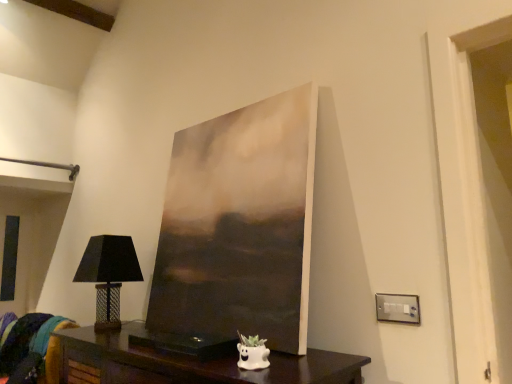
What do you see at coordinates (397, 308) in the screenshot? Image resolution: width=512 pixels, height=384 pixels. I see `satin silver switchplate at lower right` at bounding box center [397, 308].

This screenshot has width=512, height=384. Describe the element at coordinates (189, 363) in the screenshot. I see `dark wood table at lower center` at that location.

Identify the location of velvet teal cushion at lower left. This screenshot has height=384, width=512. (32, 349).

Which object is thinner, matte black lampshade at left or dark wood table at lower center?

Thinner between the two is matte black lampshade at left.

Measure the distance from matte black lampshade at left to dark wood table at lower center.

matte black lampshade at left and dark wood table at lower center are 39.56 centimeters apart.

Would you say matte black lampshade at left contains dark wood table at lower center?

No.

Is satin silver switchplate at lower right located within dark wood table at lower center?

No, satin silver switchplate at lower right is not surrounded by dark wood table at lower center.

Measure the distance from dark wood table at lower center to satin silver switchplate at lower right.

66.97 centimeters.

Is the position of dark wood table at lower center more distant than that of satin silver switchplate at lower right?

No, it is in front of satin silver switchplate at lower right.

Consider the image. Who is taller, dark wood table at lower center or satin silver switchplate at lower right?

With more height is dark wood table at lower center.

Looking at this image, is velvet teal cushion at lower left completely or partially outside of satin silver switchplate at lower right?

Yes, velvet teal cushion at lower left is located beyond the bounds of satin silver switchplate at lower right.

Considering the relative positions of velvet teal cushion at lower left and satin silver switchplate at lower right in the image provided, is velvet teal cushion at lower left to the left of satin silver switchplate at lower right from the viewer's perspective?

Yes.

The width and height of the screenshot is (512, 384). What are the coordinates of `swivel chair behind the satin silver switchplate at lower right` in the screenshot? It's located at (32, 349).

Does velvet teal cushion at lower left have a lesser width compared to satin silver switchplate at lower right?

No, velvet teal cushion at lower left is not thinner than satin silver switchplate at lower right.

Looking at this image, how distant is satin silver switchplate at lower right from matte black lampshade at left?

satin silver switchplate at lower right and matte black lampshade at left are 1.38 meters apart from each other.

Between satin silver switchplate at lower right and matte black lampshade at left, which one has larger size?

With larger size is matte black lampshade at left.

Is matte black lampshade at left completely or partially inside satin silver switchplate at lower right?

That's incorrect, matte black lampshade at left is not inside satin silver switchplate at lower right.

Could you tell me if satin silver switchplate at lower right is turned towards matte black lampshade at left?

No, satin silver switchplate at lower right does not turn towards matte black lampshade at left.

Considering the positions of point (139, 377) and point (50, 344), is point (139, 377) closer or farther from the camera than point (50, 344)?

Point (139, 377) appears to be closer to the viewer than point (50, 344).

Is dark wood table at lower center looking in the opposite direction of velvet teal cushion at lower left?

No, dark wood table at lower center is not facing the opposite direction of velvet teal cushion at lower left.

Find the location of `table beneath the velvet teal cushion at lower left (from a real-world perspective)`. table beneath the velvet teal cushion at lower left (from a real-world perspective) is located at coordinates (189, 363).

Is dark wood table at lower center bigger or smaller than velvet teal cushion at lower left?

Clearly, dark wood table at lower center is larger in size than velvet teal cushion at lower left.

Considering the relative positions of matte black lampshade at left and velvet teal cushion at lower left in the image provided, is matte black lampshade at left to the left of velvet teal cushion at lower left from the viewer's perspective?

No.

Is matte black lampshade at left taller than velvet teal cushion at lower left?

Indeed, matte black lampshade at left has a greater height compared to velvet teal cushion at lower left.

Is matte black lampshade at left in contact with velvet teal cushion at lower left?

No, matte black lampshade at left is not with velvet teal cushion at lower left.

How different are the orientations of matte black lampshade at left and velvet teal cushion at lower left in degrees?

The angular difference between matte black lampshade at left and velvet teal cushion at lower left is 35.6 degrees.

Could you tell me if velvet teal cushion at lower left is turned towards dark wood table at lower center?

No, velvet teal cushion at lower left is not aimed at dark wood table at lower center.

Visually, is velvet teal cushion at lower left positioned to the left or to the right of dark wood table at lower center?

Based on their positions, velvet teal cushion at lower left is located to the left of dark wood table at lower center.

From the image's perspective, does velvet teal cushion at lower left appear higher than dark wood table at lower center?

Actually, velvet teal cushion at lower left appears below dark wood table at lower center in the image.

The height and width of the screenshot is (384, 512). What are the coordinates of `table lamp positioned vertically above the dark wood table at lower center (from a real-world perspective)` in the screenshot? It's located at (x=108, y=275).

Where is `electric outlet that appears on the right of dark wood table at lower center`? The height and width of the screenshot is (384, 512). electric outlet that appears on the right of dark wood table at lower center is located at coordinates (397, 308).

From the image, which object appears to be farther from satin silver switchplate at lower right, dark wood table at lower center or velvet teal cushion at lower left?

velvet teal cushion at lower left is positioned further to the anchor satin silver switchplate at lower right.

Considering their positions, is matte black lampshade at left positioned closer to dark wood table at lower center than satin silver switchplate at lower right?

Based on the image, matte black lampshade at left appears to be nearer to dark wood table at lower center.

Estimate the real-world distances between objects in this image. Which object is closer to velvet teal cushion at lower left, satin silver switchplate at lower right or matte black lampshade at left?

Based on the image, matte black lampshade at left appears to be nearer to velvet teal cushion at lower left.

Considering their positions, is dark wood table at lower center positioned closer to velvet teal cushion at lower left than matte black lampshade at left?

matte black lampshade at left is positioned closer to the anchor velvet teal cushion at lower left.

Looking at the image, which one is located further to satin silver switchplate at lower right, dark wood table at lower center or matte black lampshade at left?

matte black lampshade at left lies further to satin silver switchplate at lower right than the other object.

Looking at the image, which one is located closer to matte black lampshade at left, satin silver switchplate at lower right or velvet teal cushion at lower left?

Among the two, velvet teal cushion at lower left is located nearer to matte black lampshade at left.

In the scene shown: Looking at the image, which one is located further to matte black lampshade at left, velvet teal cushion at lower left or satin silver switchplate at lower right?

satin silver switchplate at lower right is positioned further to the anchor matte black lampshade at left.

Considering their positions, is satin silver switchplate at lower right positioned further to dark wood table at lower center than velvet teal cushion at lower left?

satin silver switchplate at lower right.

The width and height of the screenshot is (512, 384). I want to click on table between velvet teal cushion at lower left and satin silver switchplate at lower right from left to right, so (x=189, y=363).

The image size is (512, 384). I want to click on table lamp between velvet teal cushion at lower left and satin silver switchplate at lower right, so click(108, 275).

At what (x,y) coordinates should I click in order to perform the action: click on table located between matte black lampshade at left and satin silver switchplate at lower right in the left-right direction. Please return your answer as a coordinate pair (x, y). Looking at the image, I should click on (189, 363).

Locate an element on the screen. table lamp between dark wood table at lower center and velvet teal cushion at lower left from front to back is located at coordinates (108, 275).